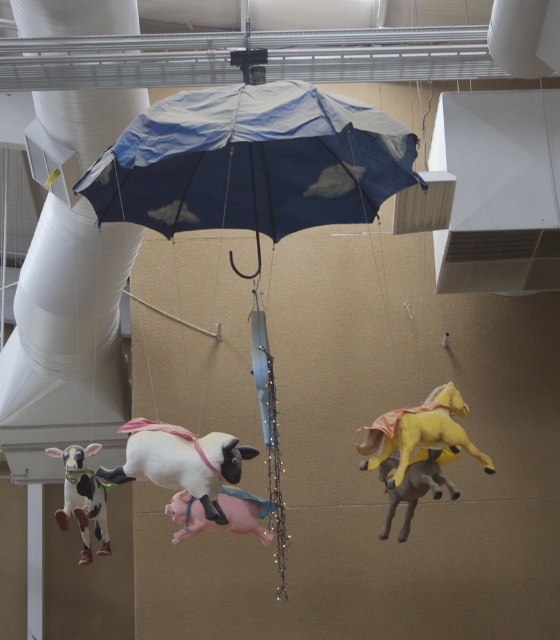
Looking at this image, you are standing in the room and want to take a photo of the white matte sheep at center. If your camera can focus on objects up to 4 meters away, will you be able to capture a clear photo?

The white matte sheep at center is 4.22 meters away from the camera, which exceeds the camera focus limit of 4 meters. Therefore, you won the clear photo.

In the scene shown: You are an art curator planning to install a new sculpture in the gallery. You notice the white matte sheep at center and the white and black spotted plastic cow at lower left hanging from the same umbrella. Which animal is shorter?

The white matte sheep at center is shorter than the white and black spotted plastic cow at lower left.

You are an art installer who needs to place a new decorative light at the exact location of point (180, 460). According to the scene, where should you place the light?

The point (180, 460) is on white matte sheep at center, so you should place the light on the white matte sheep at center.